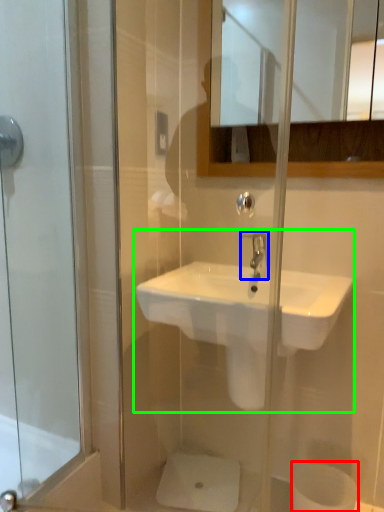
Question: Based on their relative distances, which object is nearer to toilet paper (highlighted by a red box)? Choose from tap (highlighted by a blue box) and sink (highlighted by a green box).

Choices:
 (A) tap
 (B) sink

Answer: (B)